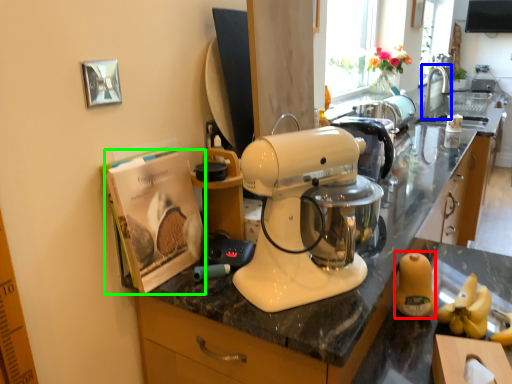
Question: Which object is positioned closest to food (highlighted by a red box)? Select from faucet (highlighted by a blue box) and magazine (highlighted by a green box).

Choices:
 (A) faucet
 (B) magazine

Answer: (B)